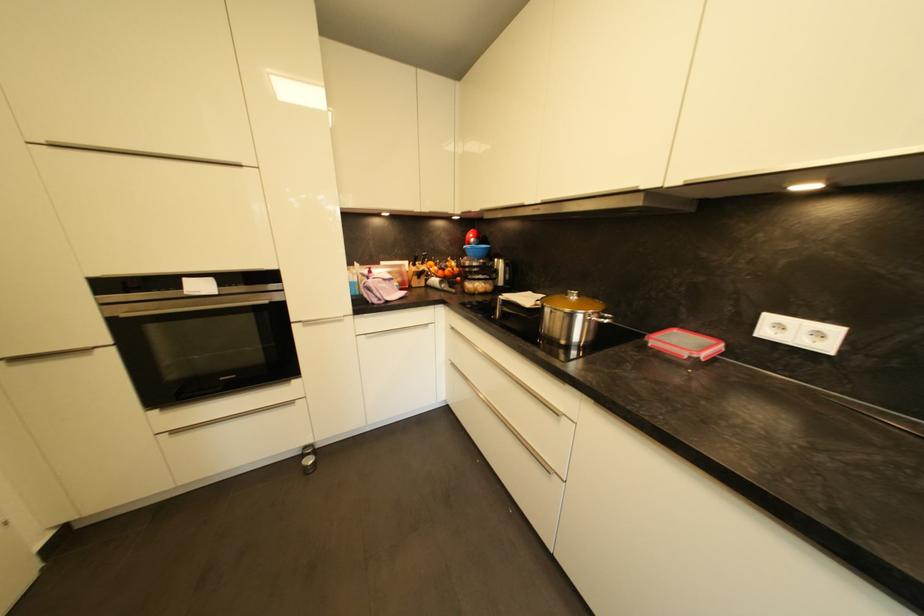
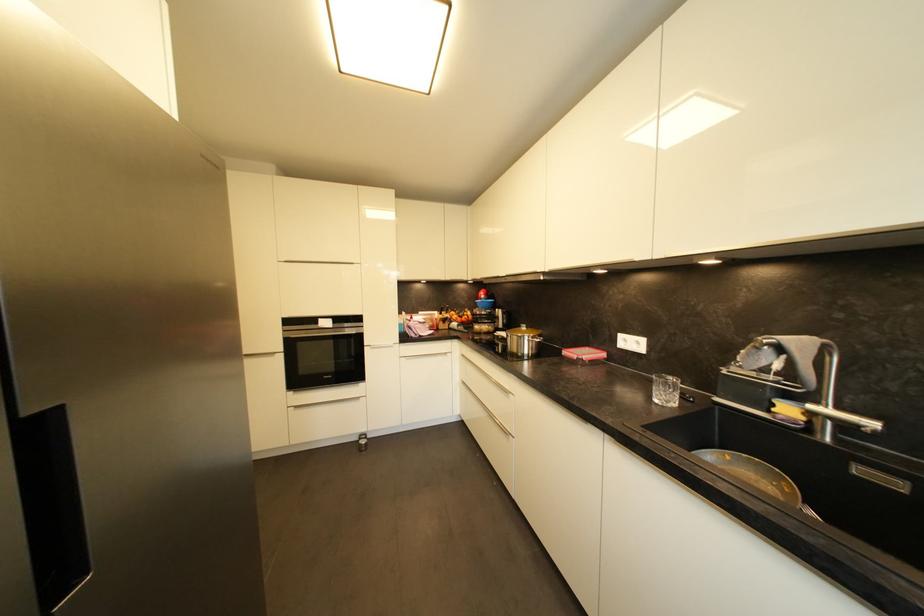
In the second image, find the point that corresponds to the point at 700,333 in the first image.

(602, 350)